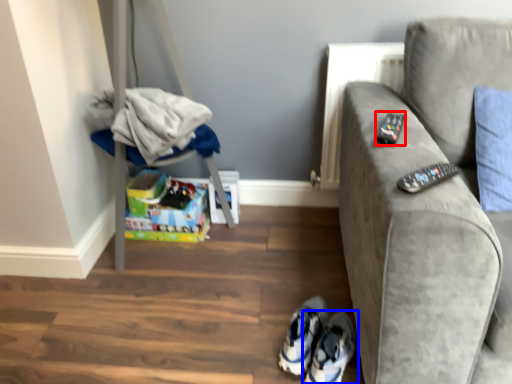
Question: Which of the following is the closest to the observer, remote (highlighted by a red box) or footwear (highlighted by a blue box)?

Choices:
 (A) remote
 (B) footwear

Answer: (A)